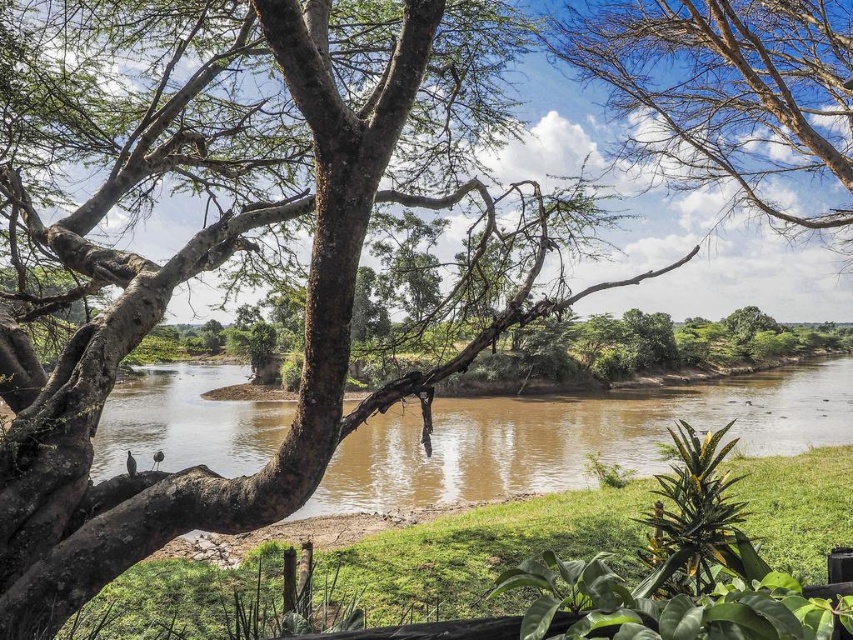
You are an environmental scientist assessing a local park. You observe the brown muddy water at center and the bare branches at upper center in the scene. Which object occupies a larger horizontal space in the image?

The brown muddy water at center has a greater width than the bare branches at upper center, so it occupies a larger horizontal space in the image.

You are standing at the edge of a forest clearing and see the brown muddy water at center. There is a small wooden bridge 5.40 meters away from it. Can you safely cross the bridge to reach the water?

The brown muddy water at center is 5.40 meters away from the small wooden bridge, so yes, you can safely cross the bridge to reach the water.